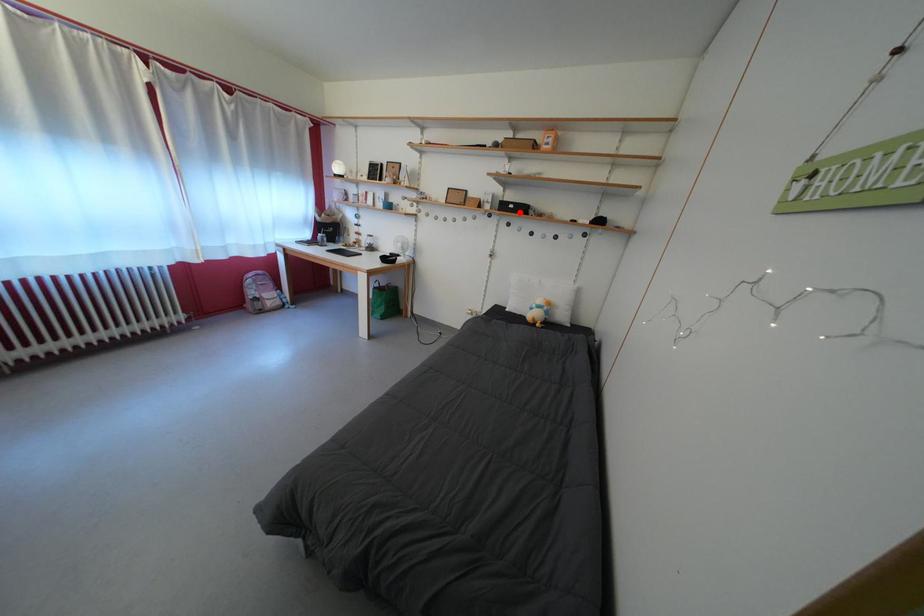
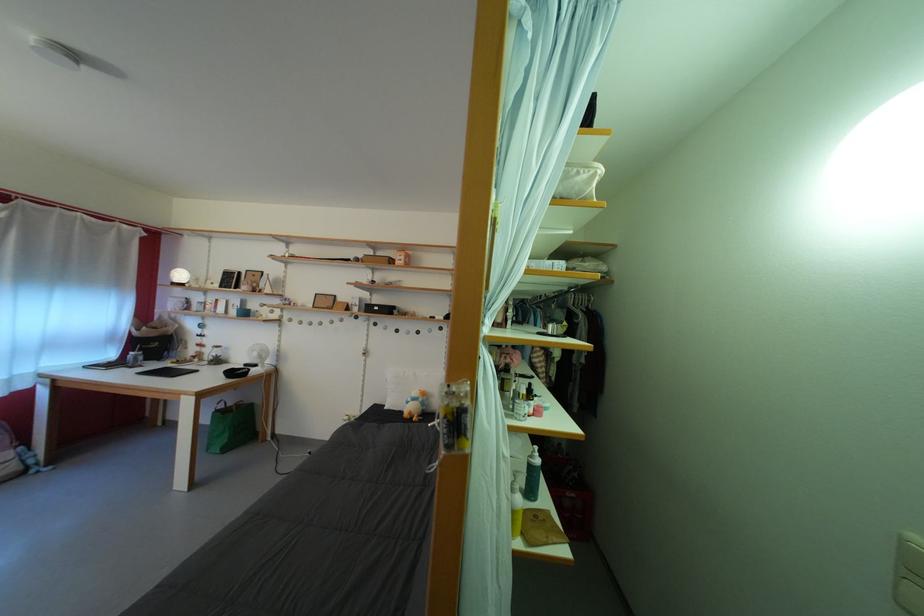
Find the pixel in the second image that matches the highlighted location in the first image.

(384, 314)